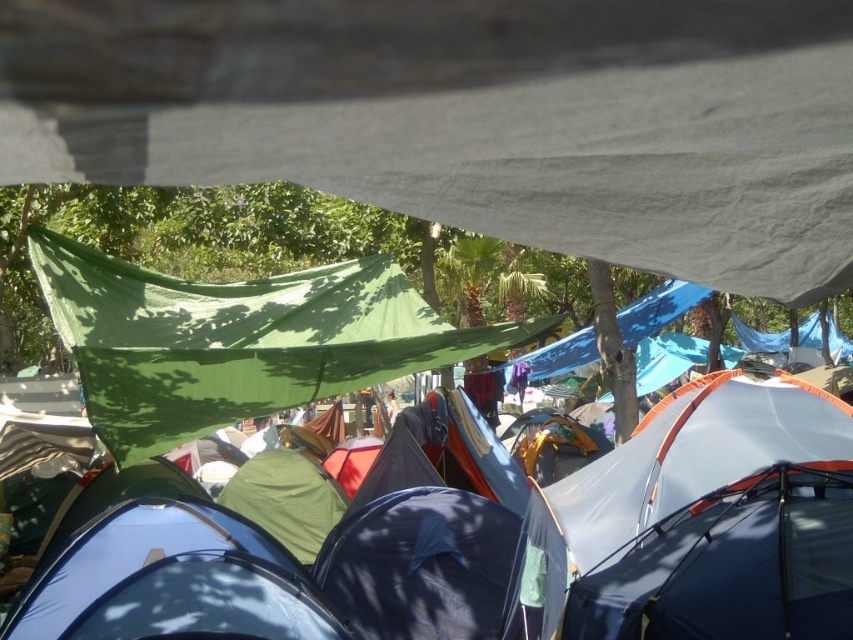
You are setting up a picnic blanket in the campsite and want to ensure it stays dry if it rains. You have two options for placement under the green fabric canopy at upper left or near the green fabric tent at center. Which location would provide better protection from rain?

The green fabric canopy at upper left provides better protection from rain because it is above the green fabric tent at center and can shield the picnic blanket from rain more effectively.

You are setting up a picnic blanket in the campsite and need to choose between placing it under the green fabric tent at center or the green fabric canopy at upper left. Which location offers more horizontal space for spreading out the blanket?

The green fabric canopy at upper left offers more horizontal space because it has a greater width than the green fabric tent at center.

You are standing in the campsite and want to set up your tent. You see the green fabric tent at center and the green fabric canopy at upper left. Which object is positioned more to the right side of the scene?

The green fabric tent at center is positioned more to the right side of the scene compared to the green fabric canopy at upper left.